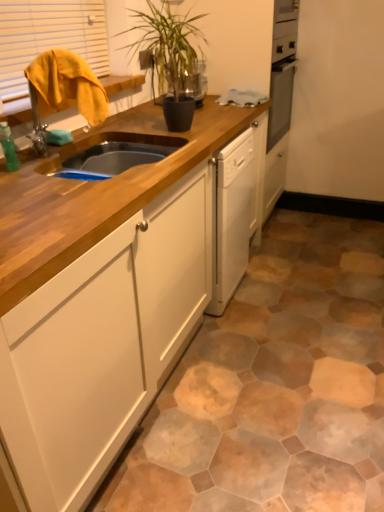
Question: Is green leafy plant at upper center positioned in front of wooden cabinet at center?

Choices:
 (A) no
 (B) yes

Answer: (A)

Question: Is wooden cabinet at center at the back of green leafy plant at upper center?

Choices:
 (A) no
 (B) yes

Answer: (A)

Question: From a real-world perspective, is green leafy plant at upper center located higher than wooden cabinet at center?

Choices:
 (A) yes
 (B) no

Answer: (A)

Question: Is green leafy plant at upper center not close to wooden cabinet at center?

Choices:
 (A) yes
 (B) no

Answer: (B)

Question: Is green leafy plant at upper center at the left side of wooden cabinet at center?

Choices:
 (A) yes
 (B) no

Answer: (B)

Question: Considering the relative positions of green leafy plant at upper center and wooden cabinet at center in the image provided, is green leafy plant at upper center to the right of wooden cabinet at center from the viewer's perspective?

Choices:
 (A) yes
 (B) no

Answer: (A)

Question: Considering the relative sizes of wooden cabinet at center and yellow fabric at upper left in the image provided, is wooden cabinet at center wider than yellow fabric at upper left?

Choices:
 (A) no
 (B) yes

Answer: (B)

Question: Can you confirm if wooden cabinet at center is bigger than yellow fabric at upper left?

Choices:
 (A) no
 (B) yes

Answer: (B)

Question: Can you confirm if wooden cabinet at center is shorter than yellow fabric at upper left?

Choices:
 (A) no
 (B) yes

Answer: (A)

Question: Is yellow fabric at upper left at the back of wooden cabinet at center?

Choices:
 (A) no
 (B) yes

Answer: (A)

Question: From a real-world perspective, is wooden cabinet at center on top of yellow fabric at upper left?

Choices:
 (A) yes
 (B) no

Answer: (B)

Question: Is wooden cabinet at center taller than yellow fabric at upper left?

Choices:
 (A) yes
 (B) no

Answer: (A)

Question: Considering the relative sizes of green leafy plant at upper center and green matte bottle at left in the image provided, is green leafy plant at upper center thinner than green matte bottle at left?

Choices:
 (A) yes
 (B) no

Answer: (B)